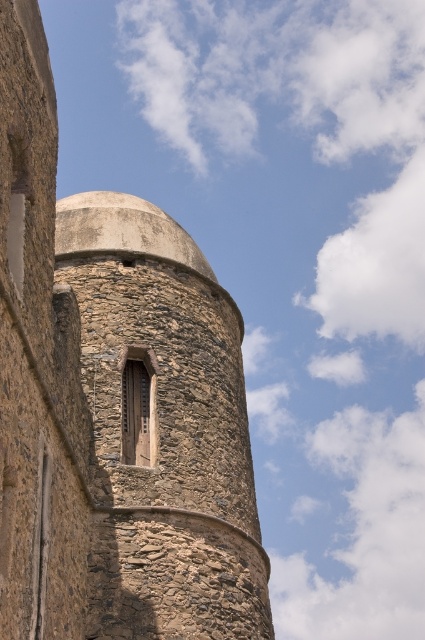
Does rustic stone tower at center have a lesser height compared to stone textured window at center?

No.

Can you confirm if rustic stone tower at center is thinner than stone textured window at center?

Incorrect, rustic stone tower at center's width is not less than stone textured window at center's.

Between point (240, 612) and point (147, 419), which one is positioned in front?

Positioned in front is point (240, 612).

This screenshot has width=425, height=640. I want to click on rustic stone tower at center, so click(163, 428).